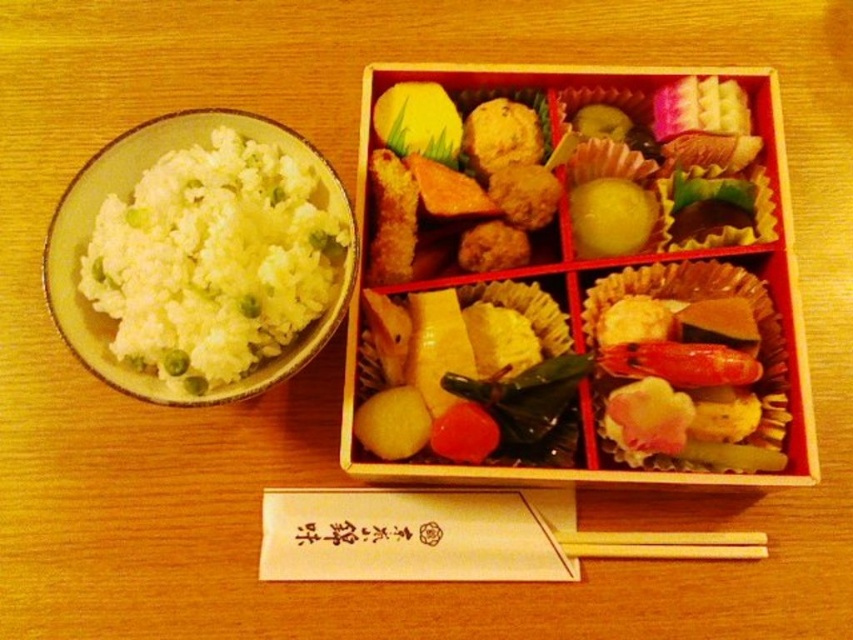
Question: Does white matte rice at left have a smaller size compared to wooden chopsticks at lower center?

Choices:
 (A) yes
 (B) no

Answer: (B)

Question: Can you confirm if white matte rice at left is positioned to the left of yellow matte ball at center?

Choices:
 (A) yes
 (B) no

Answer: (A)

Question: Which object appears farthest from the camera in this image?

Choices:
 (A) wooden chopsticks at lower center
 (B) shiny golden rice ball at center

Answer: (A)

Question: Which point is closer to the camera?

Choices:
 (A) wooden chopsticks at lower center
 (B) shiny golden rice ball at center

Answer: (B)

Question: Which of the following is the closest to the observer?

Choices:
 (A) shiny golden rice ball at center
 (B) white matte rice at left
 (C) yellow matte ball at center
 (D) wooden chopsticks at lower center

Answer: (B)

Question: Where is white matte rice at left located in relation to wooden chopsticks at lower center in the image?

Choices:
 (A) left
 (B) right

Answer: (A)